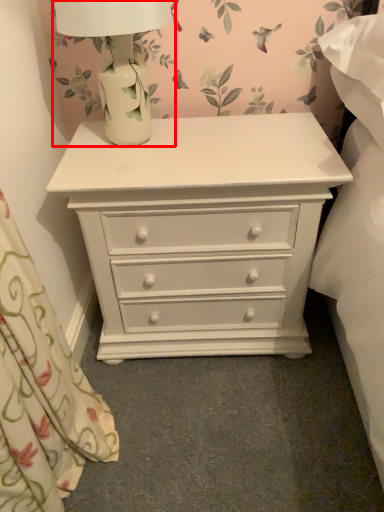
Question: In this image, where is table lamp (annotated by the red box) located relative to chest of drawers?

Choices:
 (A) right
 (B) left

Answer: (B)